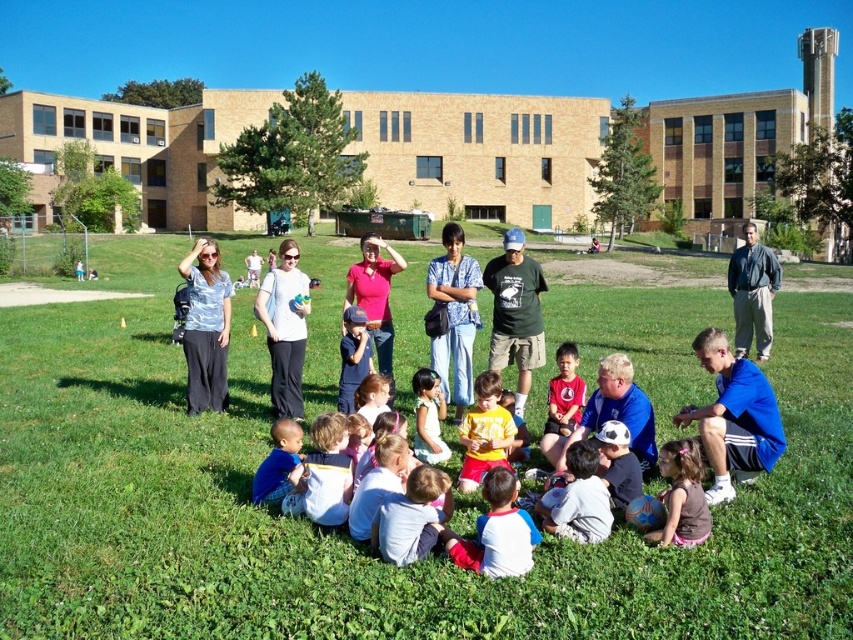
You are standing in the schoolyard and see two points marked in the scene. Which point is closer to you, point (374, 236) or point (433, 464)?

Point (374, 236) is closer to you because it is further to the viewer than point (433, 464).

You are a photographer trying to capture a photo of the matte blue shirt at center and the smooth pink shirt at center. Since you want to ensure both are in the frame, can you confirm if they are positioned side by side horizontally?

The matte blue shirt at center is to the left of the smooth pink shirt at center, so they are positioned side by side horizontally.

You are standing at the edge of the grassy area and see two pink shirts at center. The distance between them is important for setting up a game. Can you confirm if the distance between the matte pink shirt at center and the smooth pink shirt at center is more than 4 feet?

The matte pink shirt at center is 4.41 feet from the smooth pink shirt at center, so yes, the distance between them is more than 4 feet.